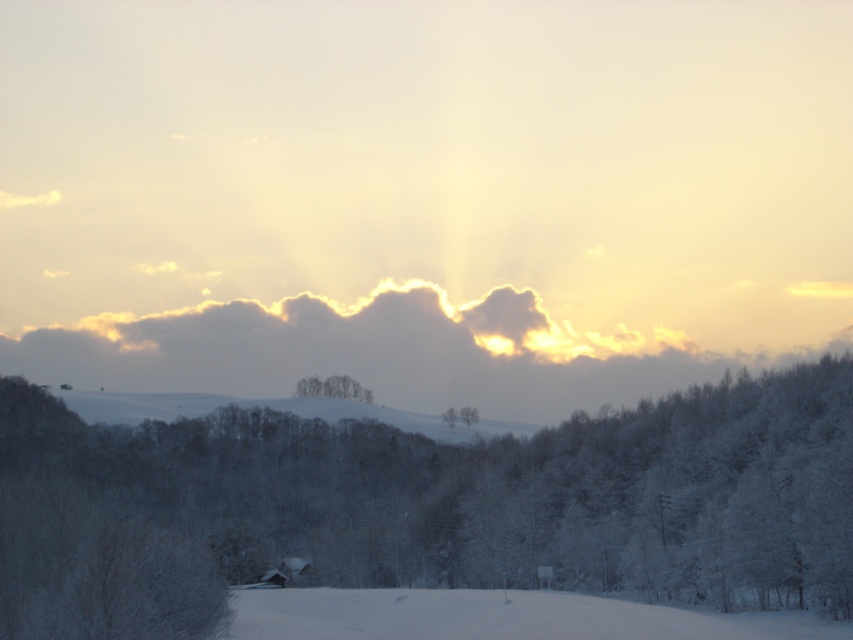
Question: Among these points, which one is farthest from the camera?

Choices:
 (A) (753, 621)
 (B) (459, 532)

Answer: (B)

Question: Observing the image, what is the correct spatial positioning of white frosty tree at center in reference to white powdery snow at lower center?

Choices:
 (A) left
 (B) right

Answer: (A)

Question: Which point is farther to the camera?

Choices:
 (A) white snow-covered trees at center
 (B) white frosty tree at center
 (C) white powdery snow at lower center

Answer: (A)

Question: Which point is closer to the camera?

Choices:
 (A) (334, 394)
 (B) (99, 540)
 (C) (474, 614)

Answer: (B)

Question: Can you confirm if white frosty tree at center is smaller than white snow-covered trees at center?

Choices:
 (A) yes
 (B) no

Answer: (B)

Question: Is white powdery snow at lower center bigger than white snow-covered trees at center?

Choices:
 (A) no
 (B) yes

Answer: (B)